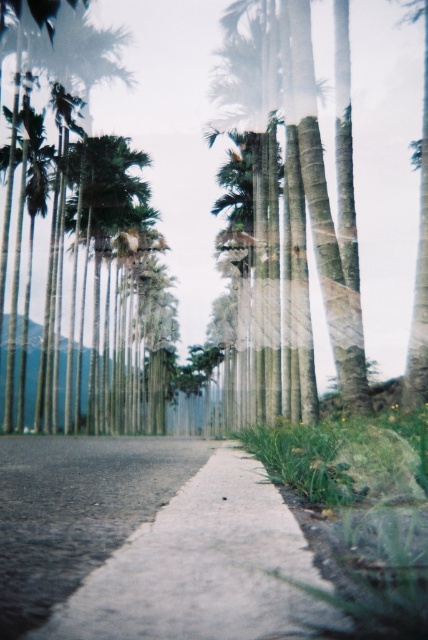
Is gray concrete pavement at center positioned behind green leafy palm tree at center?

No, gray concrete pavement at center is in front of green leafy palm tree at center.

The image size is (428, 640). Identify the location of gray concrete pavement at center. (76, 509).

Identify the location of gray concrete pavement at center. The height and width of the screenshot is (640, 428). (76, 509).